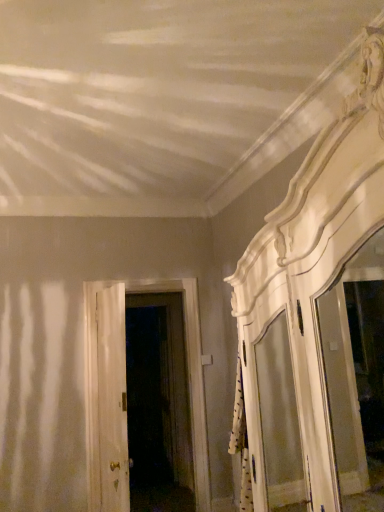
Question: Which direction should I rotate to face white wooden door at center, placed as the 2th door when sorted from front to back, — up or down?

Choices:
 (A) down
 (B) up

Answer: (A)

Question: Does white wooden door at center, the second door positioned from the back, have a lesser width compared to white wooden door at center, placed as the 2th door when sorted from front to back?

Choices:
 (A) no
 (B) yes

Answer: (B)

Question: Can we say white wooden door at center, placed as the first door when sorted from front to back, lies outside white wooden door at center, the first door when ordered from back to front?

Choices:
 (A) yes
 (B) no

Answer: (A)

Question: Does white wooden door at center, the second door positioned from the back, have a greater height compared to white wooden door at center, the first door when ordered from back to front?

Choices:
 (A) no
 (B) yes

Answer: (A)

Question: Can you confirm if white wooden door at center, the second door positioned from the back, is bigger than white wooden door at center, placed as the 2th door when sorted from front to back?

Choices:
 (A) yes
 (B) no

Answer: (B)

Question: Can you see white wooden door at center, the second door positioned from the back, touching white wooden door at center, placed as the 2th door when sorted from front to back?

Choices:
 (A) yes
 (B) no

Answer: (B)

Question: From a real-world perspective, is white wooden door at center, the second door positioned from the back, positioned under white wooden door at center, the first door when ordered from back to front, based on gravity?

Choices:
 (A) no
 (B) yes

Answer: (A)

Question: From a real-world perspective, is white wooden door at center, placed as the 2th door when sorted from front to back, physically above white wooden door at center, placed as the first door when sorted from front to back?

Choices:
 (A) no
 (B) yes

Answer: (A)

Question: Is white wooden door at center, the first door when ordered from back to front, smaller than white wooden door at center, the second door positioned from the back?

Choices:
 (A) yes
 (B) no

Answer: (B)

Question: Does white wooden door at center, the first door when ordered from back to front, have a greater height compared to white wooden door at center, placed as the first door when sorted from front to back?

Choices:
 (A) yes
 (B) no

Answer: (A)

Question: Is white wooden door at center, placed as the 2th door when sorted from front to back, further to the viewer compared to white wooden door at center, the second door positioned from the back?

Choices:
 (A) no
 (B) yes

Answer: (B)

Question: Is white wooden door at center, placed as the 2th door when sorted from front to back, positioned in front of white wooden door at center, placed as the first door when sorted from front to back?

Choices:
 (A) no
 (B) yes

Answer: (A)

Question: Is white wooden door at center, the first door when ordered from back to front, far away from white wooden door at center, the second door positioned from the back?

Choices:
 (A) no
 (B) yes

Answer: (A)

Question: From the image's perspective, is white wooden door at center, placed as the first door when sorted from front to back, located above or below white wooden door at center, placed as the 2th door when sorted from front to back?

Choices:
 (A) below
 (B) above

Answer: (B)